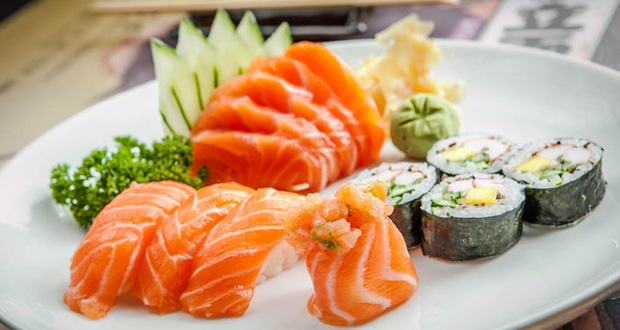
Where is `edge of plate`? The image size is (620, 330). edge of plate is located at coordinates (577, 302), (532, 313).